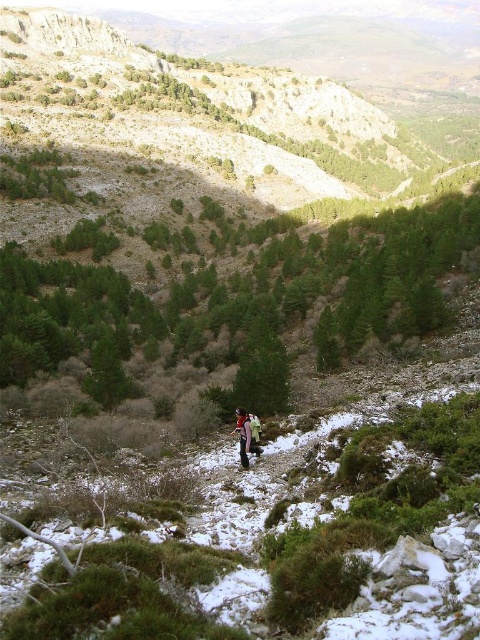
Which is below, green coniferous trees at center or red fabric jacket at center?

red fabric jacket at center is lower down.

Does green coniferous trees at center come in front of red fabric jacket at center?

No.

This screenshot has width=480, height=640. I want to click on green coniferous trees at center, so click(x=239, y=305).